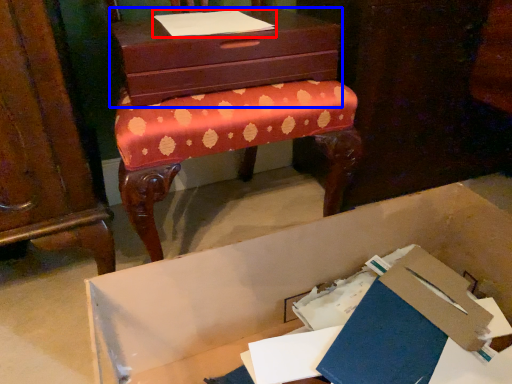
Question: Among these objects, which one is nearest to the camera, notebook (highlighted by a red box) or chest of drawers (highlighted by a blue box)?

Choices:
 (A) notebook
 (B) chest of drawers

Answer: (B)